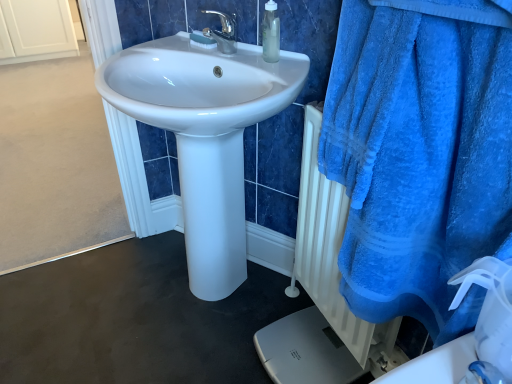
Question: Is silver metallic scale at lower right smaller than white textured radiator at lower right?

Choices:
 (A) no
 (B) yes

Answer: (B)

Question: Is silver metallic scale at lower right at the right side of white textured radiator at lower right?

Choices:
 (A) no
 (B) yes

Answer: (A)

Question: From the image's perspective, is silver metallic scale at lower right over white textured radiator at lower right?

Choices:
 (A) yes
 (B) no

Answer: (B)

Question: Is the depth of silver metallic scale at lower right greater than that of white textured radiator at lower right?

Choices:
 (A) no
 (B) yes

Answer: (B)

Question: Does silver metallic scale at lower right have a greater height compared to white textured radiator at lower right?

Choices:
 (A) no
 (B) yes

Answer: (A)

Question: Is silver metallic scale at lower right next to white textured radiator at lower right and touching it?

Choices:
 (A) yes
 (B) no

Answer: (B)

Question: Is white textured radiator at lower right to the right of white plastic brush at upper center from the viewer's perspective?

Choices:
 (A) no
 (B) yes

Answer: (B)

Question: Considering the relative sizes of white textured radiator at lower right and white plastic brush at upper center in the image provided, is white textured radiator at lower right wider than white plastic brush at upper center?

Choices:
 (A) yes
 (B) no

Answer: (A)

Question: Considering the relative positions of white textured radiator at lower right and white plastic brush at upper center in the image provided, is white textured radiator at lower right to the left of white plastic brush at upper center from the viewer's perspective?

Choices:
 (A) yes
 (B) no

Answer: (B)

Question: Are white textured radiator at lower right and white plastic brush at upper center making contact?

Choices:
 (A) yes
 (B) no

Answer: (B)

Question: From the image's perspective, is white textured radiator at lower right located above white plastic brush at upper center?

Choices:
 (A) no
 (B) yes

Answer: (A)

Question: Can you confirm if white textured radiator at lower right is smaller than white plastic brush at upper center?

Choices:
 (A) no
 (B) yes

Answer: (A)

Question: Can you confirm if blue plush towel at right is shorter than white plastic brush at upper center?

Choices:
 (A) no
 (B) yes

Answer: (A)